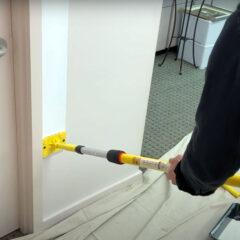
Identify the location of carpet. This screenshot has height=240, width=240. (172, 102).